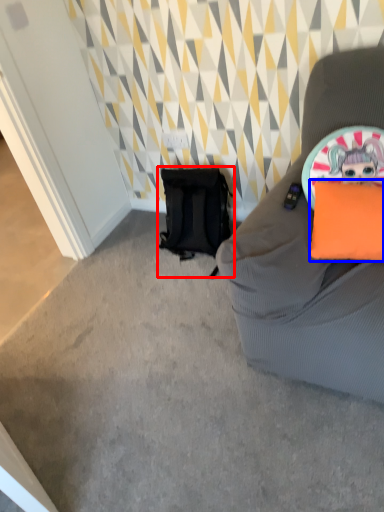
Question: Which of the following is the farthest to the observer, backpack (highlighted by a red box) or pillow (highlighted by a blue box)?

Choices:
 (A) backpack
 (B) pillow

Answer: (A)